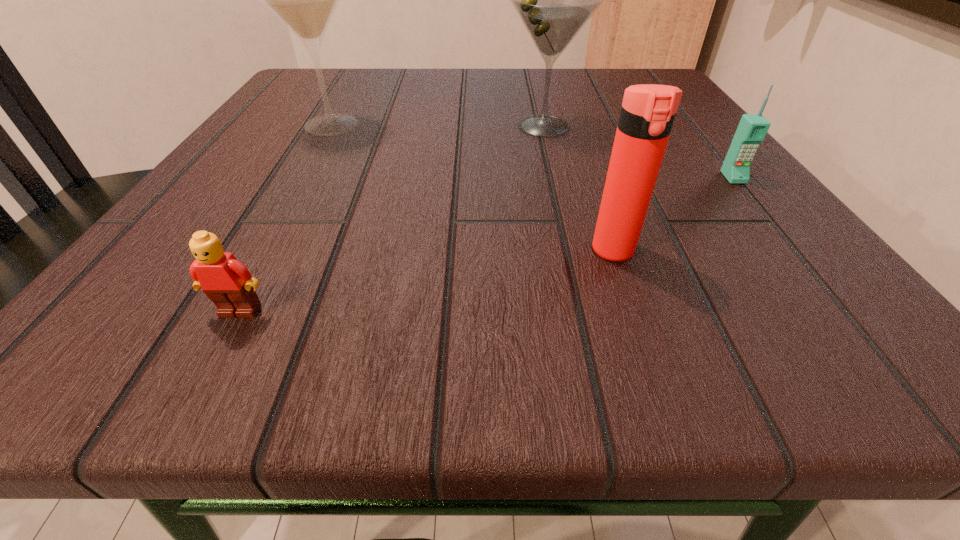
The width and height of the screenshot is (960, 540). In order to click on vacant area that lies between the thermos bottle and the cellular telephone in this screenshot , I will do `click(674, 214)`.

Where is `empty location between the right martini and the nearest object`? empty location between the right martini and the nearest object is located at coordinates (392, 219).

Locate an element on the screen. This screenshot has height=540, width=960. the third closest object to the fourth tallest object is located at coordinates (304, 0).

Locate which object is the second closest to the second shortest object. Please provide its 2D coordinates. Your answer should be formatted as a tuple, i.e. [(x, y)], where the tuple contains the x and y coordinates of a point satisfying the conditions above.

[(648, 111)]

Locate an element on the screen. The width and height of the screenshot is (960, 540). free space that satisfies the following two spatial constraints: 1. on the front side of the right martini; 2. on the right side of the thermos bottle is located at coordinates (573, 251).

Locate an element on the screen. vacant region that satisfies the following two spatial constraints: 1. on the front side of the left martini; 2. on the right side of the right martini is located at coordinates (331, 126).